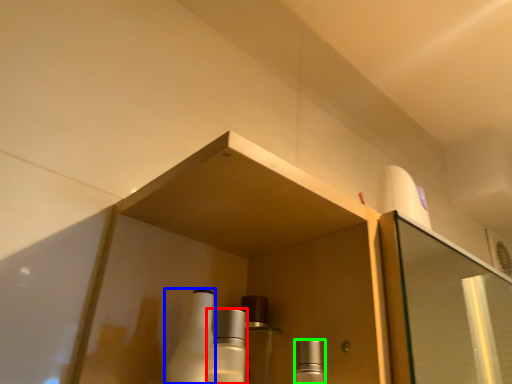
Question: Which object is positioned closest to mouthwash (highlighted by a red box)? Select from bottle (highlighted by a blue box) and mouthwash (highlighted by a green box).

Choices:
 (A) bottle
 (B) mouthwash

Answer: (A)